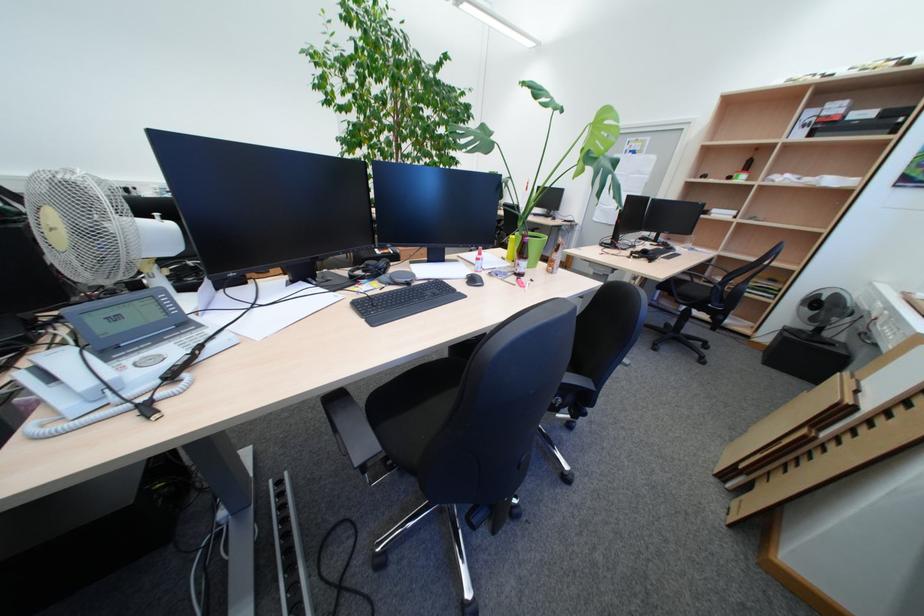
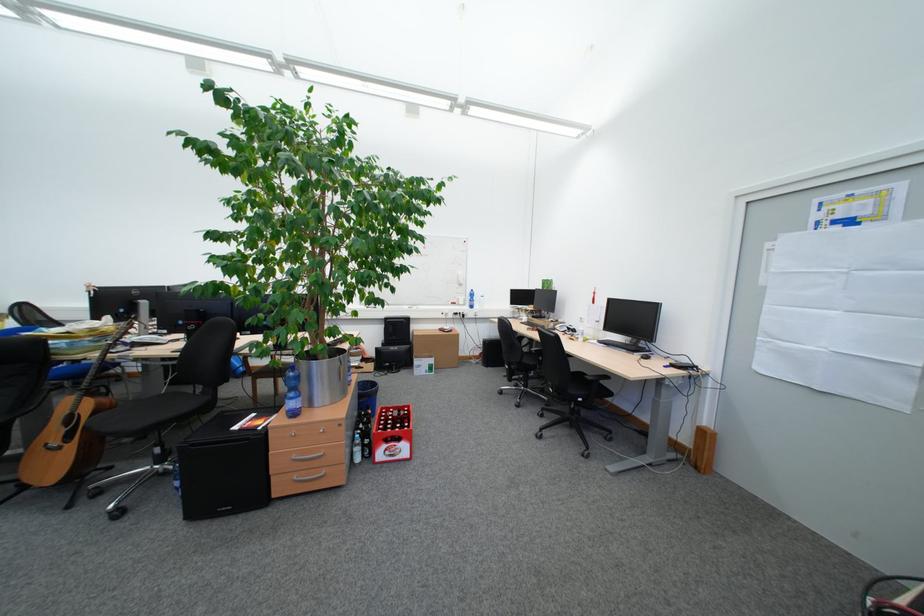
Where in the second image is the point corresponding to (558,217) from the first image?

(642, 350)